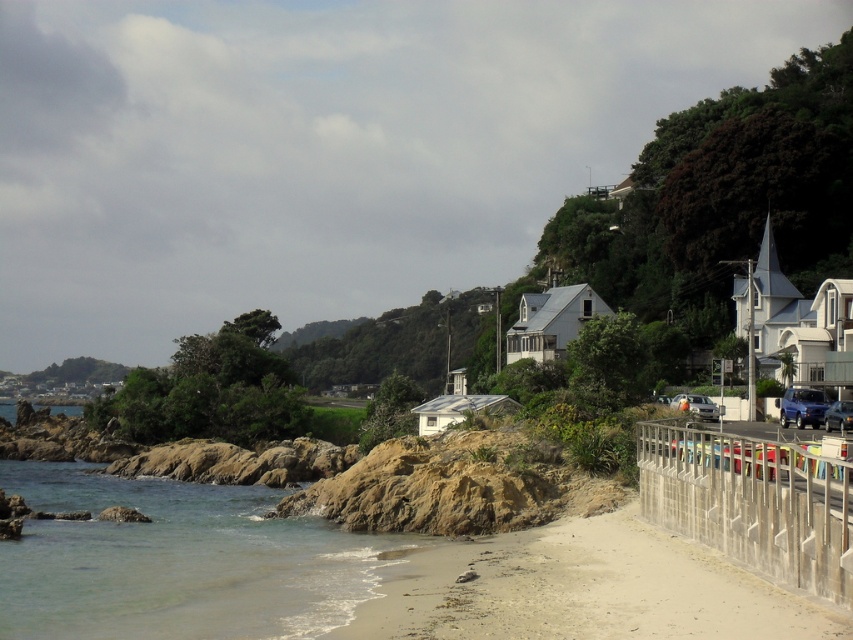
Is point (33, 465) behind point (708, 417)?

Yes, point (33, 465) is farther from viewer.

Who is more distant from viewer, [79,570] or [712,416]?

Positioned behind is point [712,416].

Locate an element on the screen. clear sandstone water at lower left is located at coordinates (175, 561).

Does point (828, 508) come closer to viewer compared to point (676, 397)?

Yes, point (828, 508) is in front of point (676, 397).

Who is more forward, (848, 580) or (694, 397)?

Point (848, 580) is more forward.

You are a GUI agent. You are given a task and a screenshot of the screen. Output one action in this format:
    pyautogui.click(x=<x>, y=<y>)
    Task: Click on the gray concrete fence at lower right
    
    Given the screenshot: What is the action you would take?
    pos(752,502)

Can you confirm if clear sandstone water at lower left is taller than blue metallic car at lower right?

Correct, clear sandstone water at lower left is much taller as blue metallic car at lower right.

Is point (209, 557) positioned behind point (809, 413)?

No, (209, 557) is in front of (809, 413).

You are a GUI agent. You are given a task and a screenshot of the screen. Output one action in this format:
    pyautogui.click(x=<x>, y=<y>)
    Task: Click on the clear sandstone water at lower left
    
    Given the screenshot: What is the action you would take?
    pyautogui.click(x=175, y=561)

The height and width of the screenshot is (640, 853). I want to click on clear sandstone water at lower left, so coord(175,561).